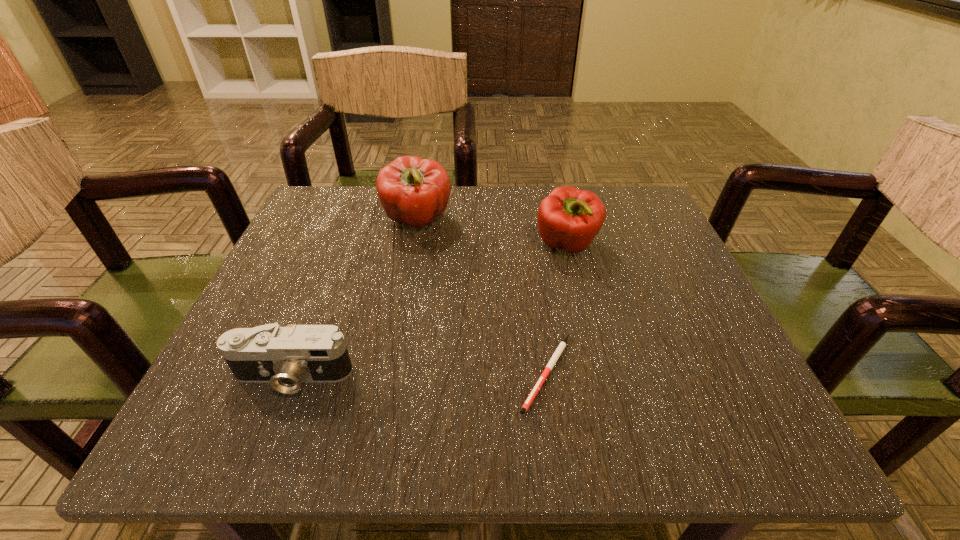
Where is `free space that is in between the third shortest object and the left bell pepper`? The height and width of the screenshot is (540, 960). free space that is in between the third shortest object and the left bell pepper is located at coordinates (492, 233).

The image size is (960, 540). Find the location of `the closest object to the right bell pepper`. the closest object to the right bell pepper is located at coordinates (414, 191).

In order to click on object that is the third closest to the second shortest object in this screenshot , I will do `click(568, 218)`.